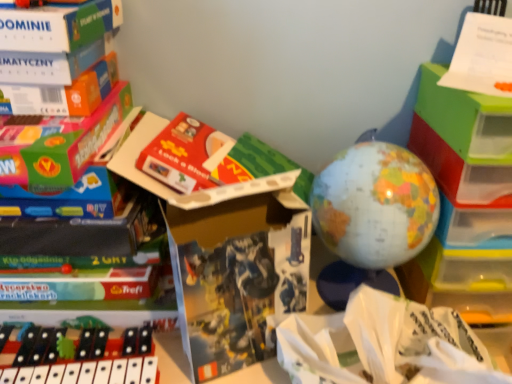
Question: Considering the relative sizes of black plastic xylophone at lower left, the first toy when ordered from bottom to top, and matte cardboard book at center in the image provided, is black plastic xylophone at lower left, the first toy when ordered from bottom to top, thinner than matte cardboard book at center?

Choices:
 (A) yes
 (B) no

Answer: (B)

Question: Is black plastic xylophone at lower left, which appears as the 1th toy when viewed from the left, facing towards matte cardboard book at center?

Choices:
 (A) yes
 (B) no

Answer: (B)

Question: From the image's perspective, is black plastic xylophone at lower left, which appears as the second toy when viewed from the top, below matte cardboard book at center?

Choices:
 (A) yes
 (B) no

Answer: (A)

Question: Considering the relative positions of black plastic xylophone at lower left, which appears as the 1th toy when viewed from the left, and matte cardboard book at center in the image provided, is black plastic xylophone at lower left, which appears as the 1th toy when viewed from the left, behind matte cardboard book at center?

Choices:
 (A) yes
 (B) no

Answer: (A)

Question: Considering the relative positions of black plastic xylophone at lower left, the first toy when ordered from bottom to top, and matte cardboard book at center in the image provided, is black plastic xylophone at lower left, the first toy when ordered from bottom to top, to the right of matte cardboard book at center from the viewer's perspective?

Choices:
 (A) yes
 (B) no

Answer: (B)

Question: From the image's perspective, is black plastic xylophone at lower left, placed as the second toy when sorted from right to left, located above or below matte plastic globe at center, the 1th toy from the top?

Choices:
 (A) below
 (B) above

Answer: (A)

Question: Does point (55, 332) appear closer or farther from the camera than point (354, 182)?

Choices:
 (A) closer
 (B) farther

Answer: (B)

Question: Based on their sizes in the image, would you say black plastic xylophone at lower left, which appears as the second toy when viewed from the top, is bigger or smaller than matte plastic globe at center, positioned as the second toy in left-to-right order?

Choices:
 (A) small
 (B) big

Answer: (A)

Question: Is black plastic xylophone at lower left, placed as the second toy when sorted from right to left, in front of or behind matte plastic globe at center, positioned as the second toy in left-to-right order, in the image?

Choices:
 (A) behind
 (B) front

Answer: (B)

Question: Looking at their shapes, would you say white paper at center is wider or thinner than black plastic xylophone at lower left, placed as the second toy when sorted from right to left?

Choices:
 (A) thin
 (B) wide

Answer: (B)

Question: Considering their positions, is white paper at center located in front of or behind black plastic xylophone at lower left, placed as the second toy when sorted from right to left?

Choices:
 (A) behind
 (B) front

Answer: (B)

Question: From a real-world perspective, is white paper at center positioned above or below black plastic xylophone at lower left, the first toy when ordered from bottom to top?

Choices:
 (A) below
 (B) above

Answer: (B)

Question: Is white paper at center to the left or to the right of black plastic xylophone at lower left, the first toy when ordered from bottom to top, in the image?

Choices:
 (A) right
 (B) left

Answer: (A)

Question: From a real-world perspective, relative to matte cardboard book at center, is white paper at center vertically above or below?

Choices:
 (A) above
 (B) below

Answer: (B)

Question: Looking at their shapes, would you say white paper at center is wider or thinner than matte cardboard book at center?

Choices:
 (A) wide
 (B) thin

Answer: (A)